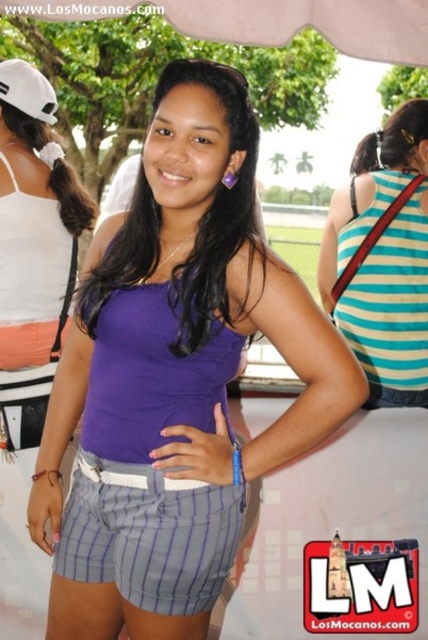
Question: Which is farther from the purple fabric skirt at lower left?

Choices:
 (A) white fabric canopy at upper center
 (B) purple fabric tank top at center
 (C) purple matte tank top at center

Answer: (A)

Question: Does striped fabric tank top at center have a larger size compared to purple matte tank top at center?

Choices:
 (A) no
 (B) yes

Answer: (B)

Question: Is the position of purple fabric tank top at center less distant than that of white fabric canopy at upper center?

Choices:
 (A) yes
 (B) no

Answer: (A)

Question: Does purple fabric skirt at lower left appear on the right side of purple matte tank top at center?

Choices:
 (A) no
 (B) yes

Answer: (A)

Question: Which point is closer to the camera?

Choices:
 (A) (225, 250)
 (B) (83, 513)
 (C) (335, 250)
 (D) (365, 49)

Answer: (A)

Question: Considering the real-world distances, which object is farthest from the striped fabric tank top at center?

Choices:
 (A) purple fabric skirt at lower left
 (B) purple matte tank top at center

Answer: (A)